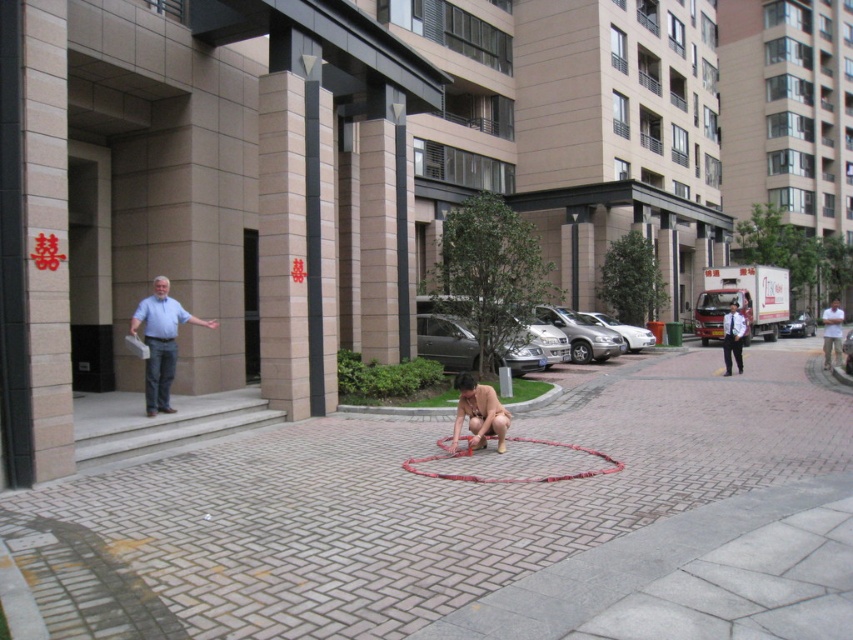
Does matte red hula hoop at center have a larger size compared to white shirt at right?

No.

Is matte red hula hoop at center to the right of white shirt at right from the viewer's perspective?

No, matte red hula hoop at center is not to the right of white shirt at right.

Locate an element on the screen. The width and height of the screenshot is (853, 640). matte red hula hoop at center is located at coordinates (479, 413).

Identify the location of matte red hula hoop at center. This screenshot has height=640, width=853. (479, 413).

Between brick pavement at center and white cotton shirt at right, which one appears on the left side from the viewer's perspective?

From the viewer's perspective, brick pavement at center appears more on the left side.

Can you confirm if brick pavement at center is positioned to the left of white cotton shirt at right?

Yes, brick pavement at center is to the left of white cotton shirt at right.

Describe the element at coordinates (474, 522) in the screenshot. I see `brick pavement at center` at that location.

Where is `brick pavement at center`? This screenshot has height=640, width=853. brick pavement at center is located at coordinates (474, 522).

Is light blue shirt at center positioned before matte red hula hoop at center?

No, light blue shirt at center is further to the viewer.

Who is more distant from viewer, (202, 321) or (508, 417)?

Positioned behind is point (202, 321).

Find the location of `light blue shirt at center`. light blue shirt at center is located at coordinates (161, 340).